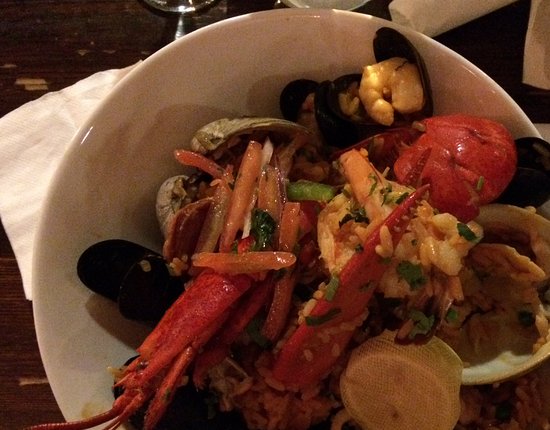
Where is `white bowl`? This screenshot has width=550, height=430. white bowl is located at coordinates (142, 80).